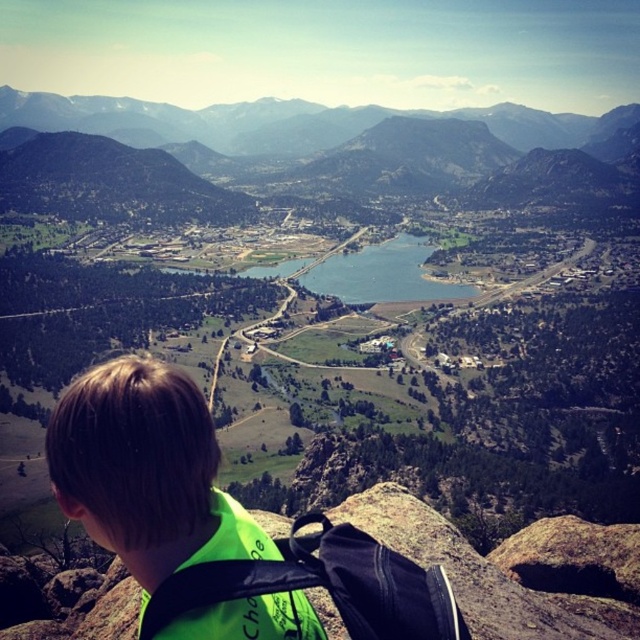
Question: From the image, what is the correct spatial relationship of green grassy mountain at upper center in relation to neon green fabric safety vest at lower left?

Choices:
 (A) above
 (B) below

Answer: (A)

Question: Is green grassy mountain at upper center to the right of neon green backpack at lower left from the viewer's perspective?

Choices:
 (A) yes
 (B) no

Answer: (A)

Question: Considering the real-world distances, which object is farthest from the green grassy mountain at upper center?

Choices:
 (A) neon green fabric safety vest at lower left
 (B) neon green backpack at lower left

Answer: (A)

Question: Among these objects, which one is farthest from the camera?

Choices:
 (A) neon green fabric safety vest at lower left
 (B) neon green backpack at lower left
 (C) green grassy mountain at upper center

Answer: (C)

Question: Can you confirm if neon green backpack at lower left is smaller than neon green fabric safety vest at lower left?

Choices:
 (A) yes
 (B) no

Answer: (B)

Question: Which point is farther to the camera?

Choices:
 (A) neon green fabric safety vest at lower left
 (B) neon green backpack at lower left

Answer: (B)